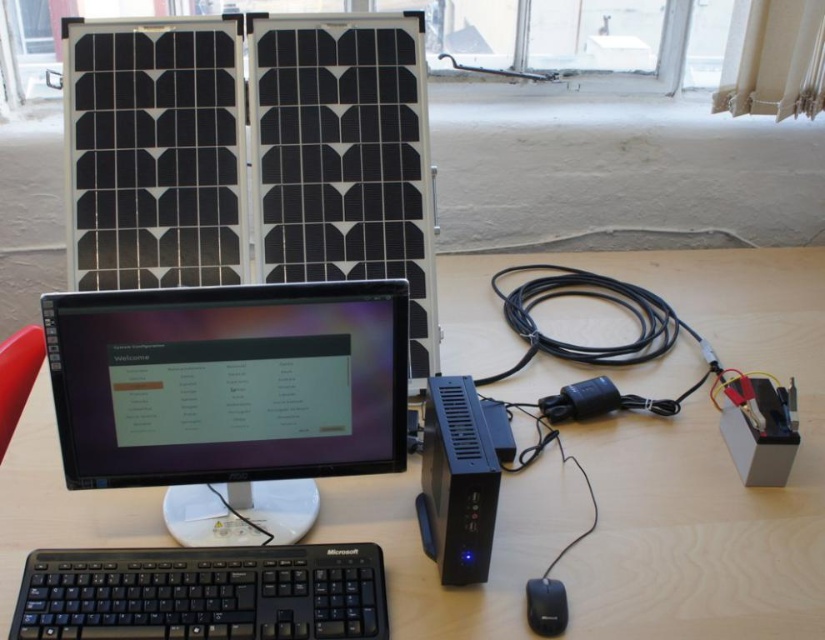
The image size is (825, 640). What do you see at coordinates (229, 397) in the screenshot? I see `black glossy monitor at center` at bounding box center [229, 397].

Is point (112, 317) positioned after point (227, 577)?

No, (112, 317) is in front of (227, 577).

This screenshot has width=825, height=640. In order to click on black glossy monitor at center in this screenshot , I will do `click(229, 397)`.

Based on the photo, who is lower down, black glossy monitor at center or black plastic solar battery at center?

black plastic solar battery at center

Is the position of black glossy monitor at center less distant than that of black plastic solar battery at center?

Yes, it is.

I want to click on black glossy monitor at center, so click(229, 397).

Does wooden at center have a smaller size compared to black plastic solar battery at center?

Actually, wooden at center might be larger than black plastic solar battery at center.

Who is more distant from viewer, (818,276) or (493,458)?

The point (818,276) is more distant.

Where is `wooden at center`? Image resolution: width=825 pixels, height=640 pixels. wooden at center is located at coordinates (686, 452).